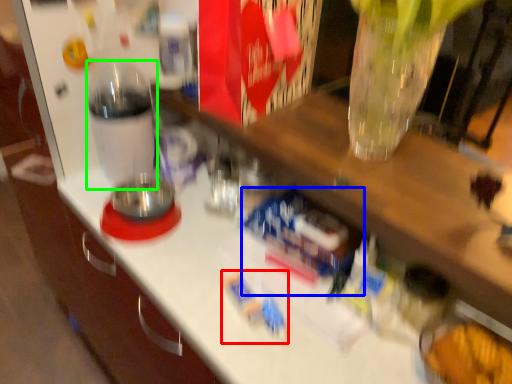
Question: Which object is positioned farthest from toy (highlighted by a red box)? Select from toy (highlighted by a blue box) and bottle (highlighted by a green box).

Choices:
 (A) toy
 (B) bottle

Answer: (B)